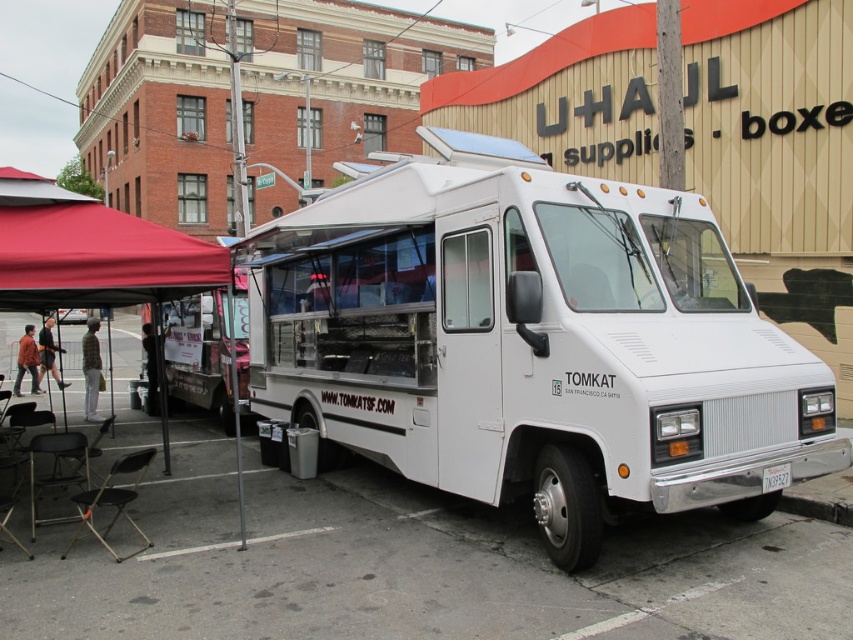
Is white matte food truck at center shorter than red fabric canopy at left?

Indeed, white matte food truck at center has a lesser height compared to red fabric canopy at left.

The height and width of the screenshot is (640, 853). What do you see at coordinates (532, 342) in the screenshot? I see `white matte food truck at center` at bounding box center [532, 342].

Does point (334, 248) come behind point (74, 262)?

Yes, it is.

Identify the location of white matte food truck at center. (532, 342).